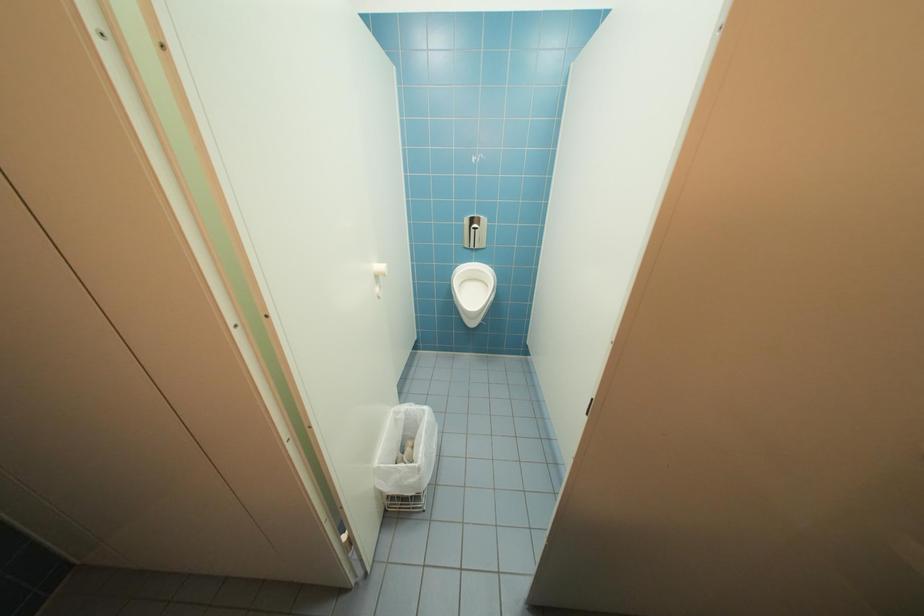
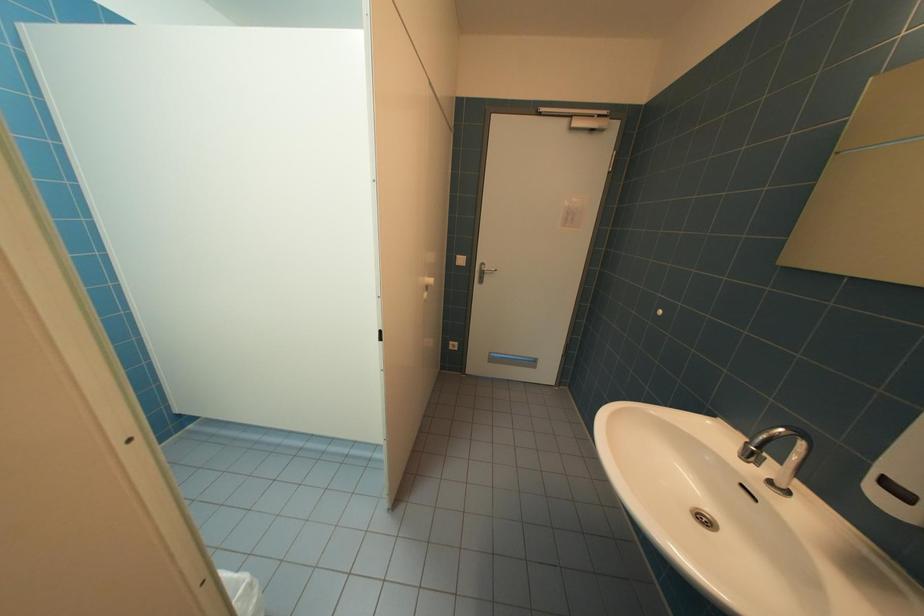
How did the camera likely rotate?

The camera rotated toward right-down.